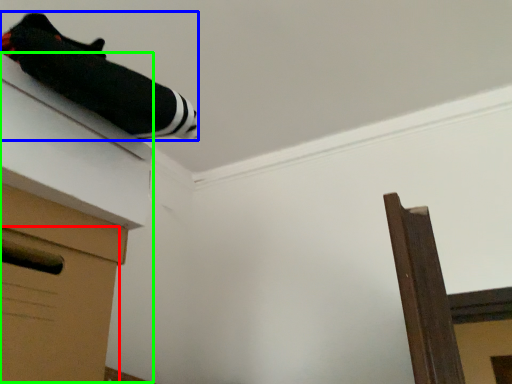
Question: Considering the real-world distances, which object is closest to drawer (highlighted by a red box)? twin (highlighted by a blue box) or vanity (highlighted by a green box).

Choices:
 (A) twin
 (B) vanity

Answer: (B)